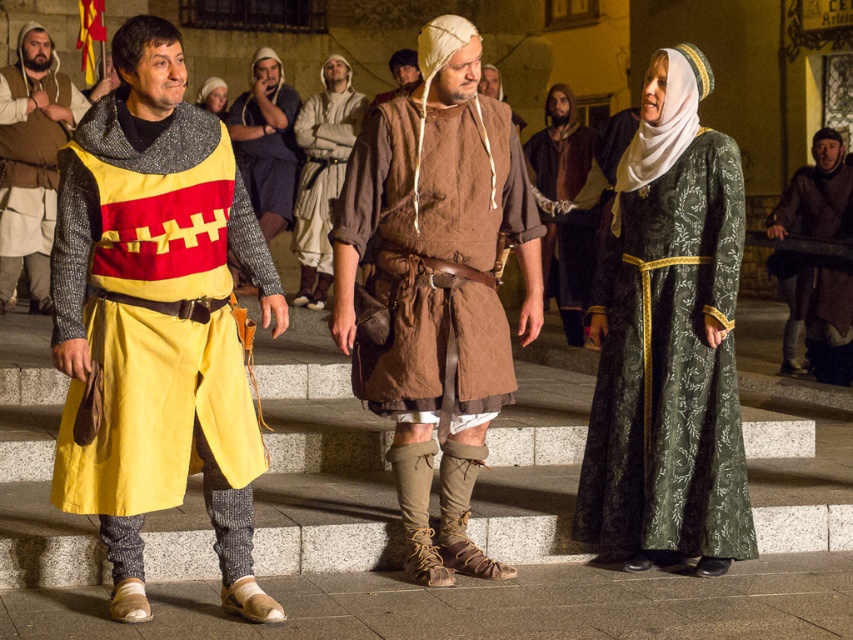
Describe the element at coordinates (437, 285) in the screenshot. I see `quilted brown tunic at center` at that location.

Where is `quilted brown tunic at center`? quilted brown tunic at center is located at coordinates (437, 285).

Is quilted brown tunic at center above brown leather armor at center?

Actually, quilted brown tunic at center is below brown leather armor at center.

Does point (407, 275) come farther from viewer compared to point (837, 346)?

No.

Locate an element on the screen. quilted brown tunic at center is located at coordinates (437, 285).

Consider the image. Between green brocade dress at center and brown leather hat at center, which one is positioned lower?

green brocade dress at center is lower down.

Who is more forward, (712, 216) or (387, 65)?

Point (712, 216)

The height and width of the screenshot is (640, 853). I want to click on green brocade dress at center, so click(668, 339).